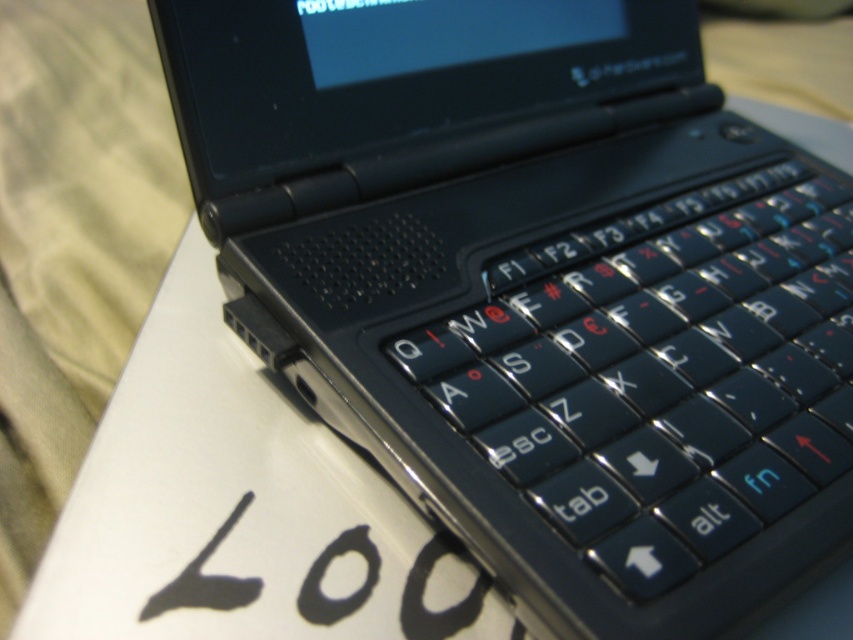
You are designing a layout for a new laptop. You have the black matte keyboard at center and the black matte writing at lower left. Which object should you place higher in the design to maintain visual balance?

To maintain visual balance, you should place the black matte keyboard at center higher since it has a greater height compared to the black matte writing at lower left.

You are trying to read the text on the black matte writing at lower left but the black matte keyboard at center is blocking your view. Can you move the keyboard to see the writing better?

The black matte keyboard at center is in front of the black matte writing at lower left, so moving it would allow you to see the writing better.